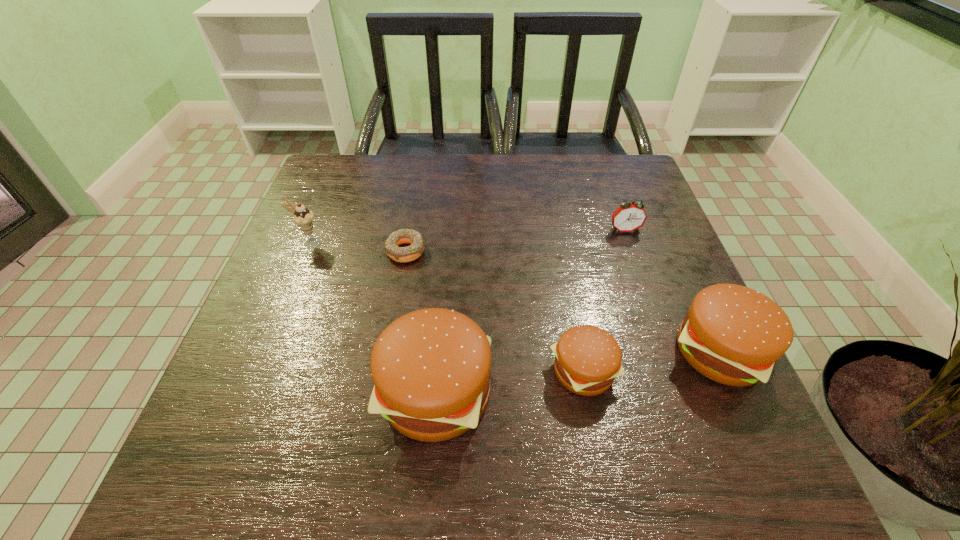
Locate an element on the screen. Image resolution: width=960 pixels, height=540 pixels. free space located on the left of the rightmost hamburger is located at coordinates (640, 352).

Locate an element on the screen. free space located on the right of the doughnut is located at coordinates (586, 251).

Identify the location of free space located on the clock face of the third shortest object. This screenshot has width=960, height=540. (645, 289).

This screenshot has height=540, width=960. Find the location of `free spot located 0.330m on the back of the icecream`. free spot located 0.330m on the back of the icecream is located at coordinates (342, 164).

The width and height of the screenshot is (960, 540). Find the location of `object that is at the left edge`. object that is at the left edge is located at coordinates 304,218.

You are a GUI agent. You are given a task and a screenshot of the screen. Output one action in this format:
    pyautogui.click(x=<x>, y=<y>)
    Task: Click on the hamburger located at the right edge
    The height and width of the screenshot is (540, 960).
    Given the screenshot: What is the action you would take?
    pyautogui.click(x=734, y=335)

Locate an element on the screen. alarm clock positioned at the right edge is located at coordinates (629, 217).

In order to click on object that is at the near right corner in this screenshot , I will do `click(734, 335)`.

Identify the location of blank space at the far edge. (382, 186).

Where is `vacant space at the near edge`? vacant space at the near edge is located at coordinates 328,412.